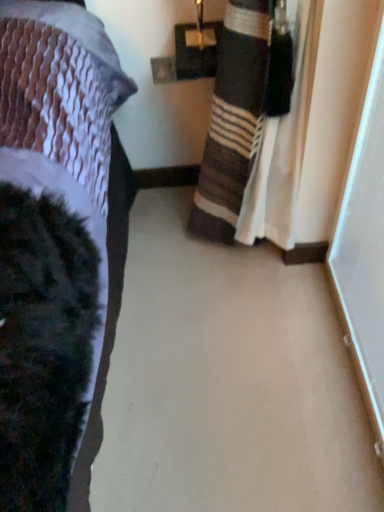
This screenshot has width=384, height=512. What do you see at coordinates (365, 245) in the screenshot? I see `white glossy screen door at right` at bounding box center [365, 245].

This screenshot has height=512, width=384. What are the coordinates of `white glossy screen door at right` in the screenshot? It's located at (365, 245).

Measure the distance between point (x=343, y=269) and camera.

Point (x=343, y=269) and camera are 1.24 meters apart from each other.

The width and height of the screenshot is (384, 512). Identify the location of white glossy screen door at right. (365, 245).